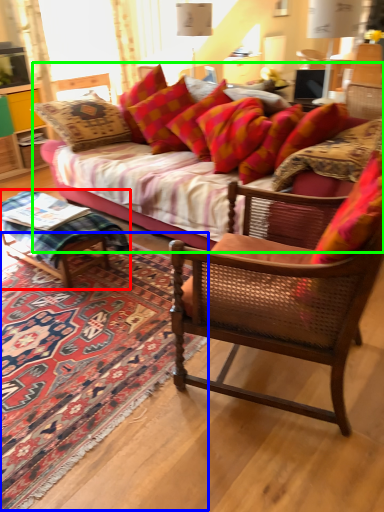
Question: Considering the real-world distances, which object is closest to coffee table (highlighted by a red box)? mat (highlighted by a blue box) or studio couch (highlighted by a green box).

Choices:
 (A) mat
 (B) studio couch

Answer: (A)